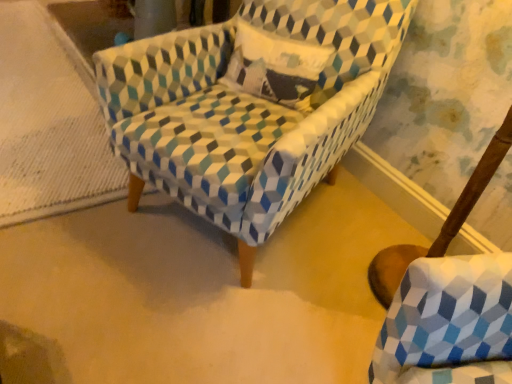
Image resolution: width=512 pixels, height=384 pixels. Find the location of `free space in front of textured fabric swivel chair at lower right`. free space in front of textured fabric swivel chair at lower right is located at coordinates (365, 276).